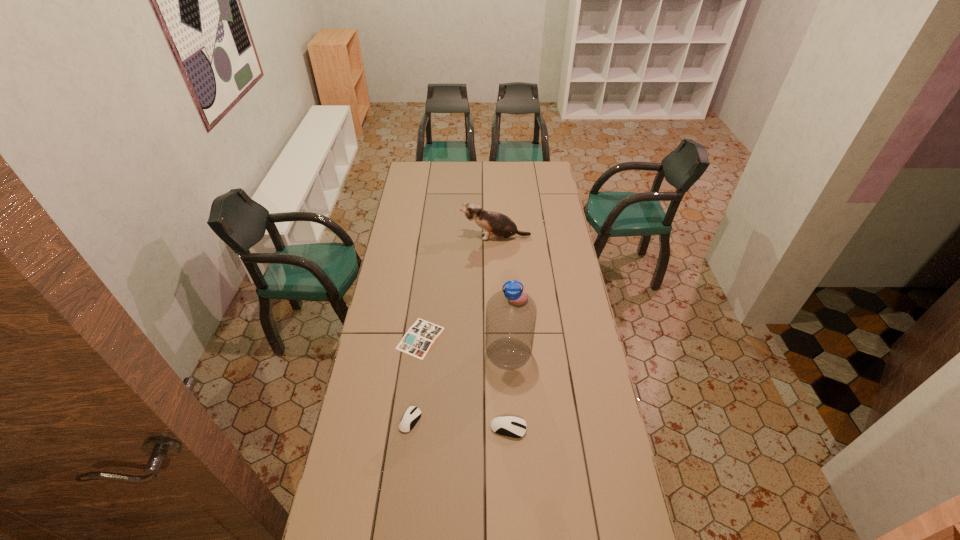
Image resolution: width=960 pixels, height=540 pixels. I want to click on free space that satisfies the following two spatial constraints: 1. on the back side of the tallest object; 2. on the left side of the taller mouse, so click(505, 354).

The height and width of the screenshot is (540, 960). Find the location of `free space that satisfies the following two spatial constraints: 1. at the face of the fifth shortest object; 2. on the back side of the right mouse`. free space that satisfies the following two spatial constraints: 1. at the face of the fifth shortest object; 2. on the back side of the right mouse is located at coordinates (504, 428).

Where is `vacant space that satisfies the following two spatial constraints: 1. at the face of the second tallest object; 2. on the right side of the tallest object`? The width and height of the screenshot is (960, 540). vacant space that satisfies the following two spatial constraints: 1. at the face of the second tallest object; 2. on the right side of the tallest object is located at coordinates (x=501, y=354).

The height and width of the screenshot is (540, 960). Find the location of `free space that satisfies the following two spatial constraints: 1. at the face of the cat; 2. on the back side of the taller mouse`. free space that satisfies the following two spatial constraints: 1. at the face of the cat; 2. on the back side of the taller mouse is located at coordinates (504, 428).